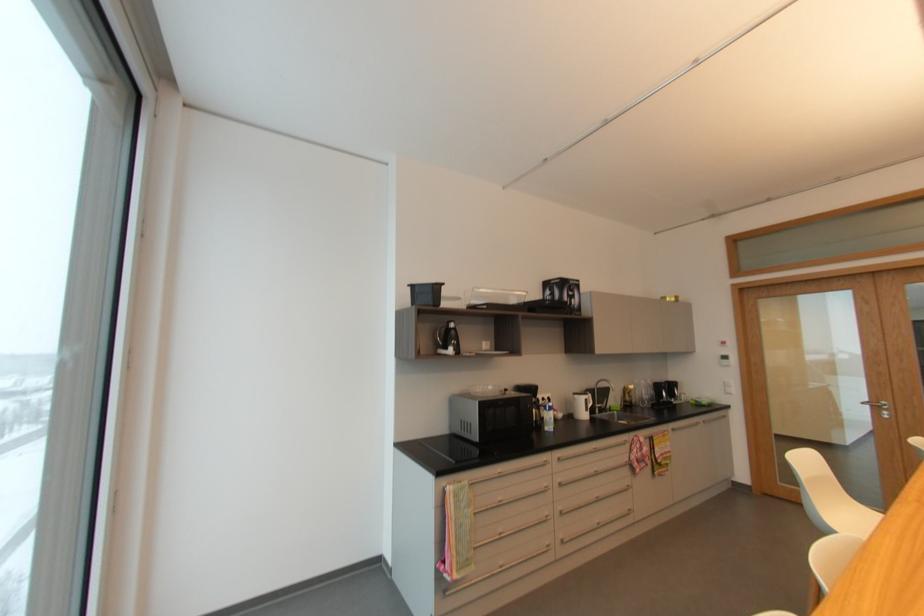
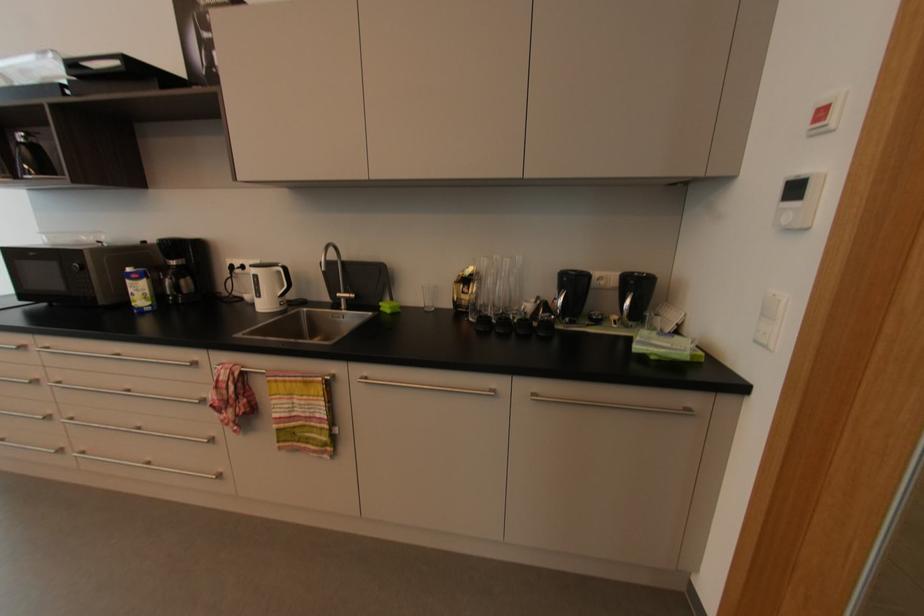
Where in the second image is the point corresponding to (x=726, y=339) from the first image?

(832, 99)